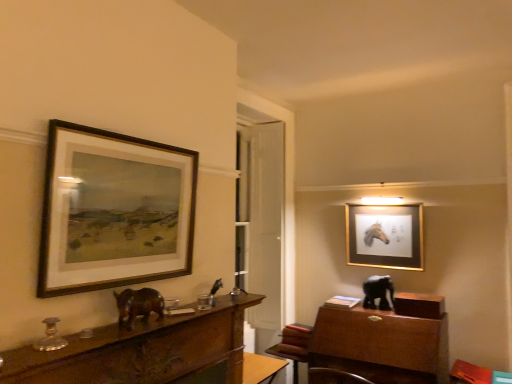
Question: Choose the correct answer: Is gold metallic picture frame at upper right, acting as the 1th picture frame starting from the right, inside wooden table at center or outside it?

Choices:
 (A) inside
 (B) outside

Answer: (B)

Question: From their relative heights in the image, would you say gold metallic picture frame at upper right, which appears as the 1th picture frame when viewed from the back, is taller or shorter than wooden table at center?

Choices:
 (A) tall
 (B) short

Answer: (A)

Question: Estimate the real-world distances between objects in this image. Which object is farther from the black glossy elephant at right, placed as the first animal when sorted from bottom to top?

Choices:
 (A) shiny brown elephant at center, which is counted as the first animal, starting from the left
 (B) wooden table at center
 (C) gold metallic picture frame at upper right, which appears as the 1th picture frame when viewed from the back
 (D) wooden-framed painting at upper left, the 1th picture frame positioned from the front
 (E) brown wooden desk at left

Answer: (D)

Question: Based on their relative distances, which object is nearer to the wooden-framed painting at upper left, which appears as the first picture frame when viewed from the left?

Choices:
 (A) brown wooden desk at left
 (B) gold metallic picture frame at upper right, marked as the second picture frame in a left-to-right arrangement
 (C) black glossy elephant at right, placed as the first animal when sorted from bottom to top
 (D) wooden table at center
 (E) shiny brown elephant at center, which is the second animal from right to left

Answer: (E)